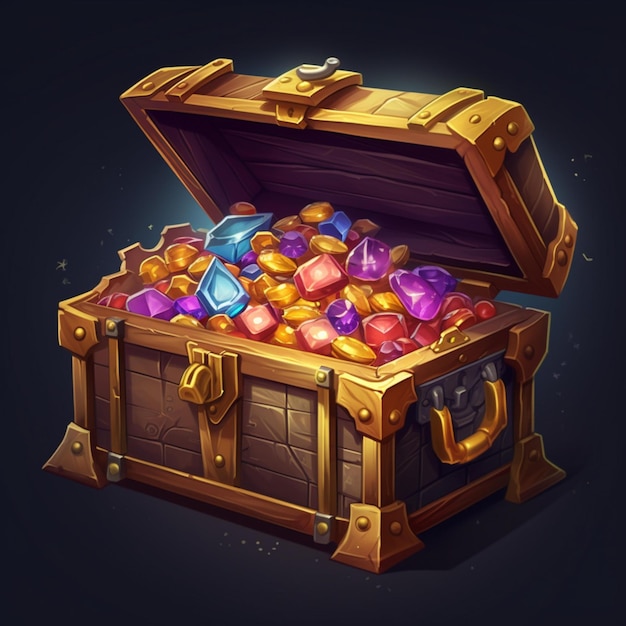
Find the location of a particular element. lock is located at coordinates (198, 381), (310, 69).